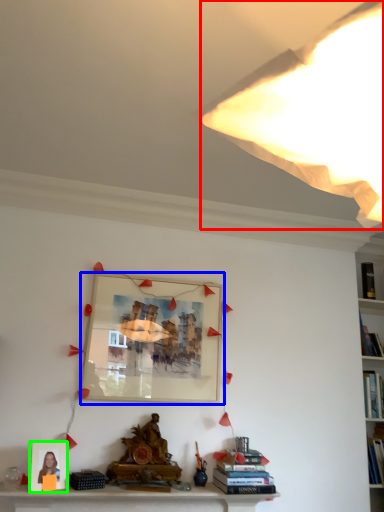
Question: Which object is the closest to the light (highlighted by a red box)? Choose among these: picture frame (highlighted by a blue box) or picture frame (highlighted by a green box).

Choices:
 (A) picture frame
 (B) picture frame

Answer: (A)